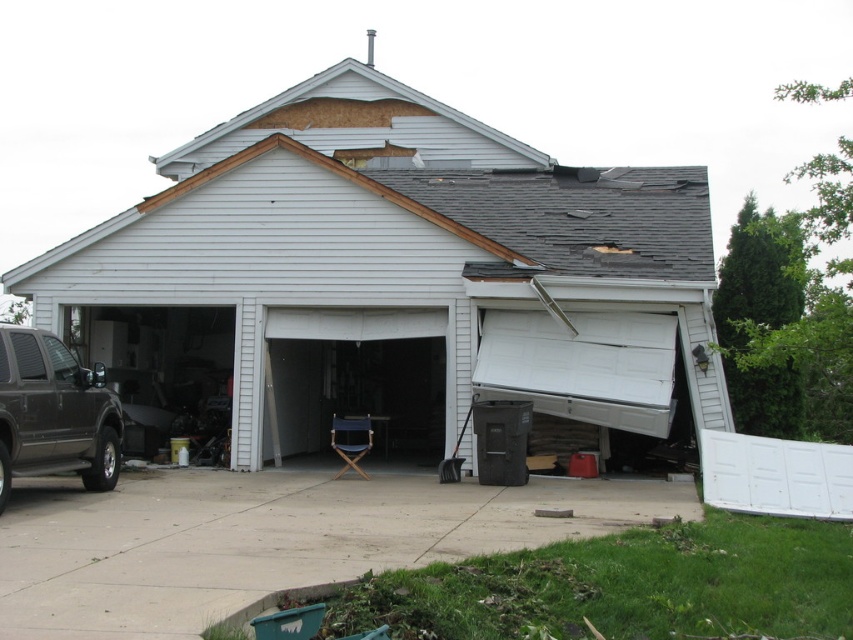
Who is shorter, transparent plastic chair at center or matte black suv at lower left?

matte black suv at lower left is shorter.

Which is in front, point (426, 349) or point (51, 460)?

Point (51, 460) is in front.

The image size is (853, 640). I want to click on transparent plastic chair at center, so click(355, 376).

Is concrete at lower center bigger than transparent plastic chair at center?

Actually, concrete at lower center might be smaller than transparent plastic chair at center.

Between concrete at lower center and transparent plastic chair at center, which one appears on the left side from the viewer's perspective?

transparent plastic chair at center

What do you see at coordinates (265, 540) in the screenshot? This screenshot has height=640, width=853. I see `concrete at lower center` at bounding box center [265, 540].

Find the location of `concrete at lower center`. concrete at lower center is located at coordinates (265, 540).

Does white matte garage door at center come in front of matte black suv at lower left?

That is False.

Between white matte garage door at center and matte black suv at lower left, which one has less height?

Standing shorter between the two is matte black suv at lower left.

You are a GUI agent. You are given a task and a screenshot of the screen. Output one action in this format:
    pyautogui.click(x=<x>, y=<y>)
    Task: Click on the white matte garage door at center
    
    Given the screenshot: What is the action you would take?
    pyautogui.click(x=396, y=278)

Where is `white matte garage door at center`? The width and height of the screenshot is (853, 640). white matte garage door at center is located at coordinates (396, 278).